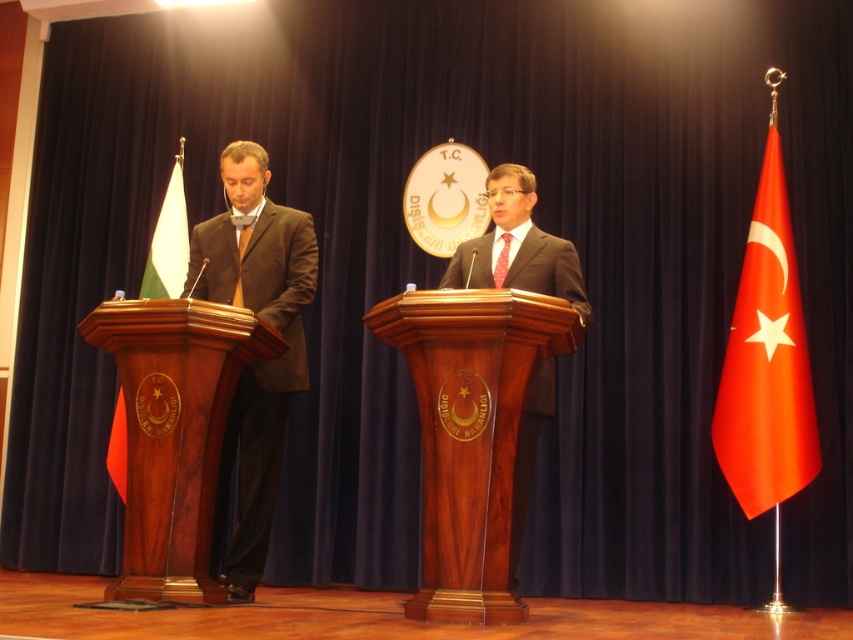
Who is positioned more to the left, wooden podium at center or wooden podium at left?

Positioned to the left is wooden podium at left.

Is wooden podium at center further to camera compared to wooden podium at left?

That is False.

The height and width of the screenshot is (640, 853). What do you see at coordinates (469, 433) in the screenshot? I see `wooden podium at center` at bounding box center [469, 433].

This screenshot has height=640, width=853. I want to click on wooden podium at center, so click(469, 433).

Who is shorter, red fabric flag at right or matte black suit at center?

Standing shorter between the two is matte black suit at center.

Does red fabric flag at right come behind matte black suit at center?

Yes, red fabric flag at right is behind matte black suit at center.

Does point (815, 448) lie in front of point (482, 278)?

No, it is not.

Identify the location of red fabric flag at right. This screenshot has width=853, height=640. (766, 362).

Can you confirm if wooden podium at center is positioned to the right of matte black suit at center?

In fact, wooden podium at center is to the left of matte black suit at center.

Is wooden podium at center positioned before matte black suit at center?

That is True.

Is point (422, 605) closer to viewer compared to point (485, 243)?

Yes, it is.

This screenshot has height=640, width=853. I want to click on wooden podium at center, so pos(469,433).